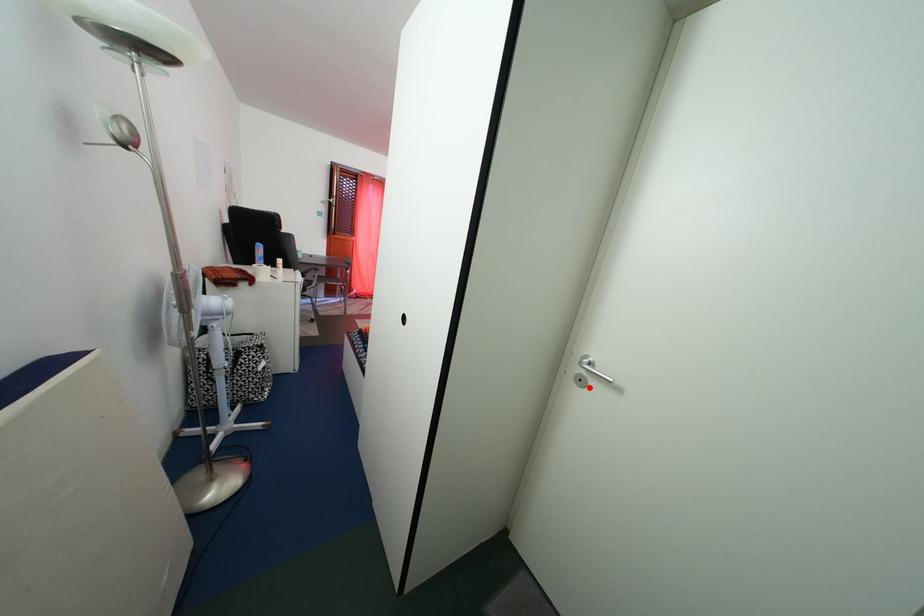
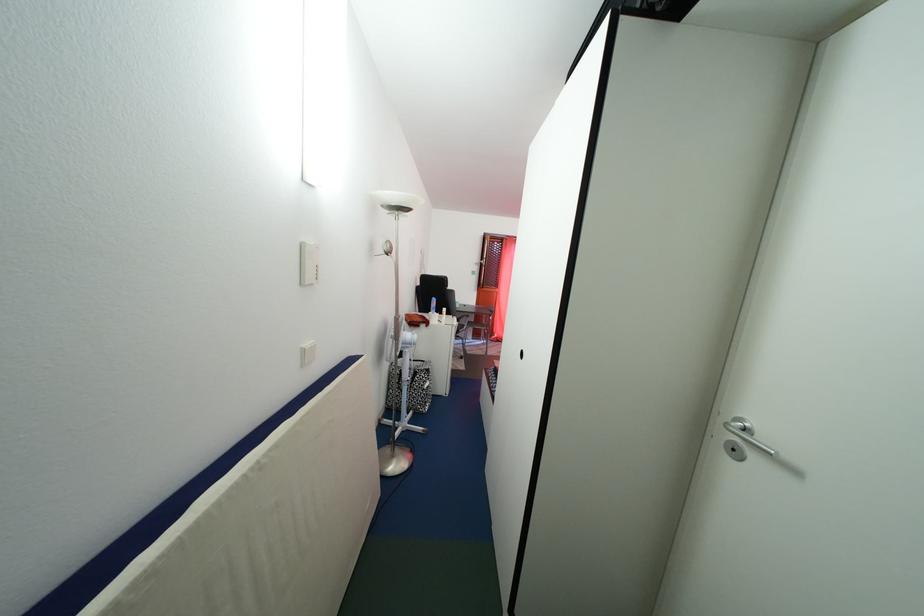
Where in the second image is the point corresponding to the highlighted location from the first image?

(743, 456)